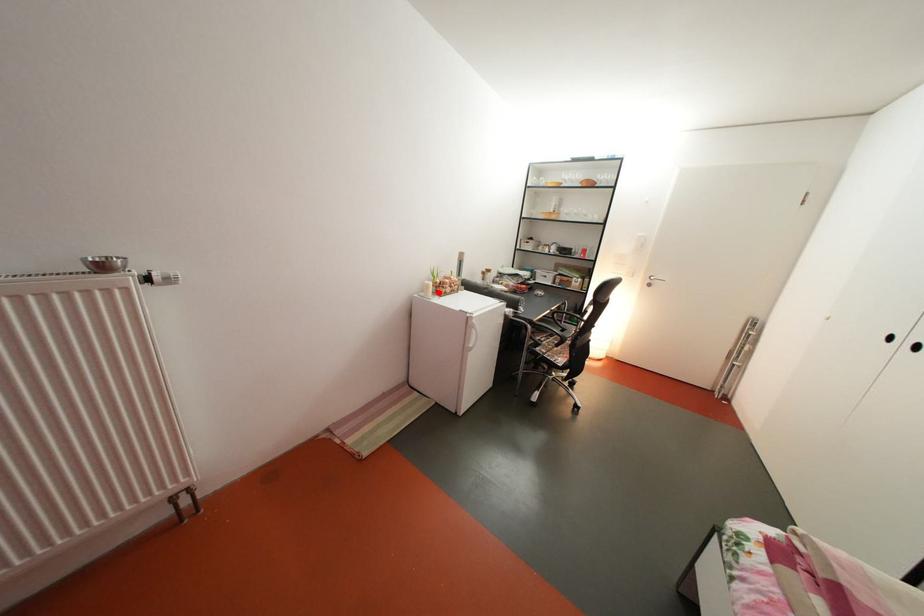
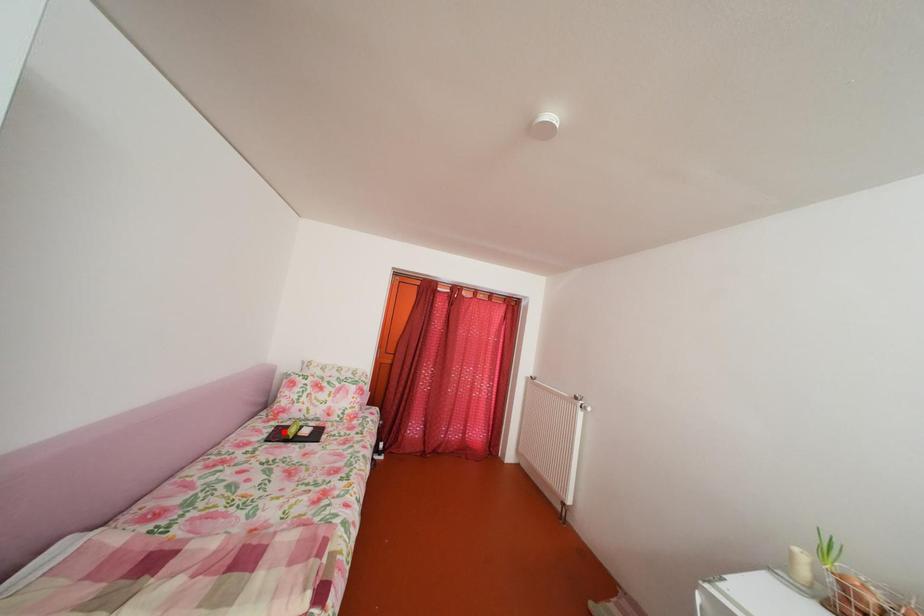
I am providing you with two images of the same scene from different viewpoints. A red point is marked on the first image and another point is marked on the second image. Are the points marked in image1 and image2 representing the same 3D position?

No